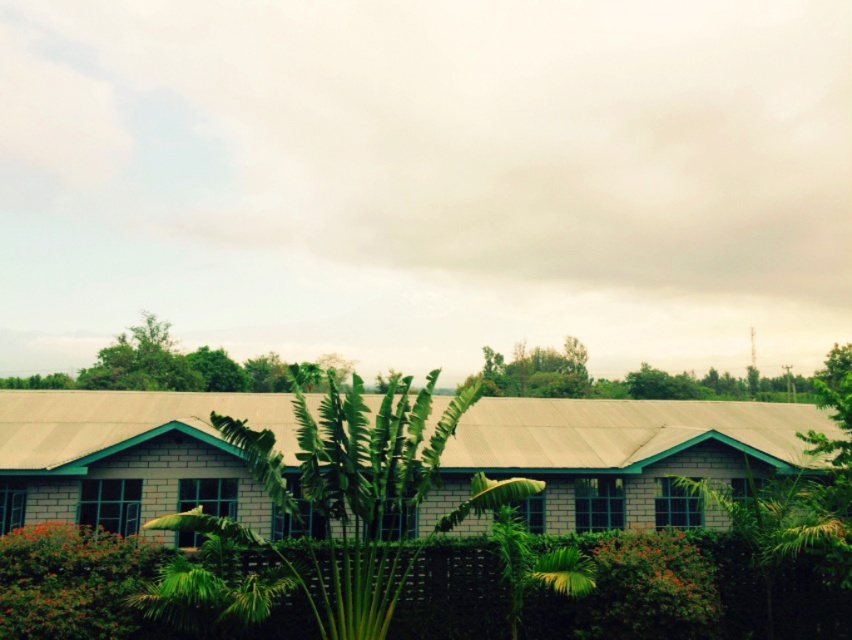
Measure the distance from white brick building at center to green leafy tree at center.

The distance of white brick building at center from green leafy tree at center is 3.61 meters.

Which is behind, point (39, 432) or point (321, 588)?

The point (39, 432) is behind.

Which is behind, point (89, 401) or point (349, 412)?

Positioned behind is point (89, 401).

Find the location of a particular element. white brick building at center is located at coordinates (620, 456).